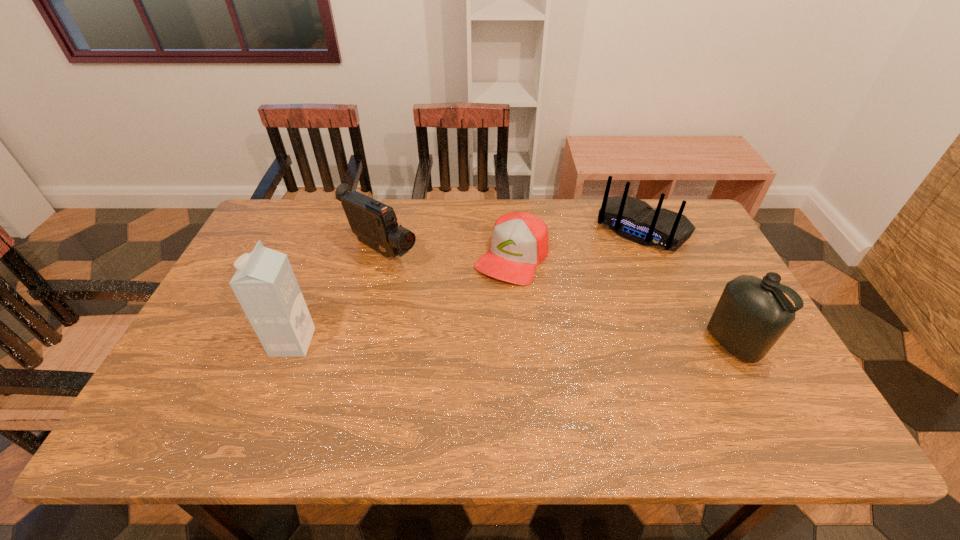
Locate an element on the screen. The width and height of the screenshot is (960, 540). free space on the desktop that is between the carton and the second tallest object and is positioned on the back of the router is located at coordinates (556, 343).

The width and height of the screenshot is (960, 540). I want to click on free space on the desktop that is between the carton and the fourth shortest object and is positioned on the front-facing side of the shortest object, so click(x=457, y=343).

This screenshot has width=960, height=540. What are the coordinates of `free space on the desktop that is between the tallest object and the bottle and is positioned on the front-facing side of the camcorder` in the screenshot? It's located at (527, 343).